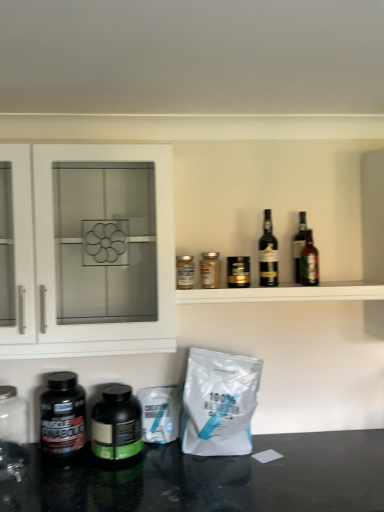
At what (x,y) coordinates should I click in order to perform the action: click on free point behind brown glass bottle at upper right, placed as the 1th bottle when sorted from right to left. Please return your answer as a coordinate pair (x, y). Looking at the image, I should click on (303, 283).